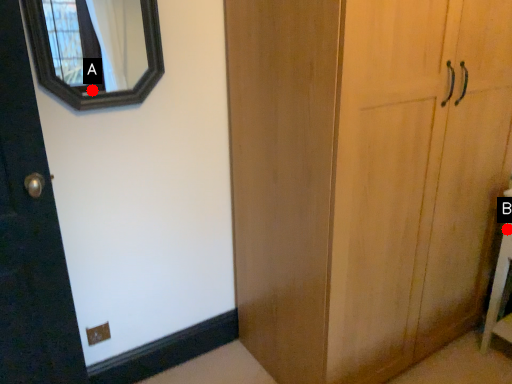
Question: Two points are circled on the image, labeled by A and B beside each circle. Which point appears farthest from the camera in this image?

Choices:
 (A) A is further
 (B) B is further

Answer: (B)